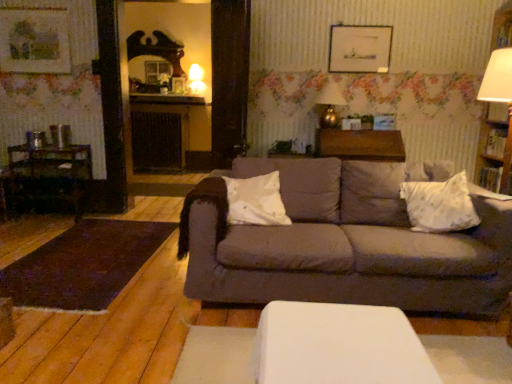
What is the approximate width of wooden table at center?

It is 20.32 inches.

Describe the element at coordinates (359, 48) in the screenshot. I see `wooden picture frame at upper center, which appears as the 2th picture frame when viewed from the left` at that location.

What do you see at coordinates (343, 244) in the screenshot?
I see `matte gray couch at center` at bounding box center [343, 244].

The width and height of the screenshot is (512, 384). Identify the location of wooden dark chair at left. (51, 178).

Would you say matte gray couch at center is inside or outside matte white glass table lamp at upper center, positioned as the first table lamp in left-to-right order?

matte gray couch at center lies outside matte white glass table lamp at upper center, positioned as the first table lamp in left-to-right order.

Between matte gray couch at center and matte white glass table lamp at upper center, which is the first table lamp from back to front, which one is positioned in front?

matte gray couch at center is more forward.

Does matte gray couch at center have a smaller size compared to matte white glass table lamp at upper center, the second table lamp when ordered from front to back?

No, matte gray couch at center is not smaller than matte white glass table lamp at upper center, the second table lamp when ordered from front to back.

From a real-world perspective, is wooden bookshelf at right above or below matte gold table lamp at upper center, acting as the first table lamp starting from the front?

From a real-world perspective, wooden bookshelf at right is physically below matte gold table lamp at upper center, acting as the first table lamp starting from the front.

Is wooden bookshelf at right bigger or smaller than matte gold table lamp at upper center, which appears as the 2th table lamp when viewed from the back?

wooden bookshelf at right is bigger than matte gold table lamp at upper center, which appears as the 2th table lamp when viewed from the back.

Is matte gold table lamp at upper center, marked as the second table lamp in a top-to-bottom arrangement, at the back of wooden bookshelf at right?

No, wooden bookshelf at right is not facing the opposite direction of matte gold table lamp at upper center, marked as the second table lamp in a top-to-bottom arrangement.

Is wooden bookshelf at right shorter than matte gold table lamp at upper center, the 2th table lamp when ordered from left to right?

No, wooden bookshelf at right is not shorter than matte gold table lamp at upper center, the 2th table lamp when ordered from left to right.

Does point (35, 69) appear closer or farther from the camera than point (196, 79)?

Point (35, 69) is positioned closer to the camera compared to point (196, 79).

Considering the sizes of wooden picture frame at upper left, the 2th picture frame positioned from the right, and matte white glass table lamp at upper center, which ranks as the 2th table lamp in right-to-left order, in the image, is wooden picture frame at upper left, the 2th picture frame positioned from the right, bigger or smaller than matte white glass table lamp at upper center, which ranks as the 2th table lamp in right-to-left order,?

wooden picture frame at upper left, the 2th picture frame positioned from the right, is smaller than matte white glass table lamp at upper center, which ranks as the 2th table lamp in right-to-left order.

Is wooden picture frame at upper left, the first picture frame in the left-to-right sequence, completely or partially outside of matte white glass table lamp at upper center, which is the first table lamp from back to front?

That's correct, wooden picture frame at upper left, the first picture frame in the left-to-right sequence, is outside of matte white glass table lamp at upper center, which is the first table lamp from back to front.

I want to click on bookshelf on the right of wooden picture frame at upper center, which appears as the first picture frame when viewed from the right, so click(x=495, y=147).

Considering the sizes of objects wooden bookshelf at right and wooden picture frame at upper center, which appears as the 2th picture frame when viewed from the left, in the image provided, who is shorter, wooden bookshelf at right or wooden picture frame at upper center, which appears as the 2th picture frame when viewed from the left,?

Standing shorter between the two is wooden picture frame at upper center, which appears as the 2th picture frame when viewed from the left.

Which is correct: wooden bookshelf at right is inside wooden picture frame at upper center, which appears as the 2th picture frame when viewed from the left, or outside of it?

wooden bookshelf at right is spatially situated outside wooden picture frame at upper center, which appears as the 2th picture frame when viewed from the left.

Does wooden bookshelf at right have a larger size compared to wooden picture frame at upper center, which appears as the first picture frame when viewed from the right?

Indeed, wooden bookshelf at right has a larger size compared to wooden picture frame at upper center, which appears as the first picture frame when viewed from the right.

At what (x,y) coordinates should I click in order to perform the action: click on chair above the matte gray couch at center (from the image's perspective). Please return your answer as a coordinate pair (x, y). Looking at the image, I should click on (51, 178).

Is matte gray couch at center with wooden dark chair at left?

No, matte gray couch at center is not in contact with wooden dark chair at left.

Could you tell me if matte gray couch at center is turned towards wooden dark chair at left?

No.

Which is more distant, (40, 12) or (362, 158)?

The point (40, 12) is farther.

From the image's perspective, is wooden picture frame at upper left, the 2th picture frame positioned from the right, above wooden table at center?

Yes, from the image's perspective, wooden picture frame at upper left, the 2th picture frame positioned from the right, is on top of wooden table at center.

From the image's perspective, which picture frame is the 2nd one above the wooden table at center? Please provide its 2D coordinates.

[(34, 40)]

Can you confirm if wooden picture frame at upper left, the 2th picture frame positioned from the right, is thinner than wooden table at center?

Yes, wooden picture frame at upper left, the 2th picture frame positioned from the right, is thinner than wooden table at center.

Locate an element on the screen. The image size is (512, 384). throw pillow above the matte gray couch at center (from a real-world perspective) is located at coordinates (440, 205).

Does matte gray couch at center have a larger size compared to white textured pillow at right?

Correct, matte gray couch at center is larger in size than white textured pillow at right.

From a real-world perspective, is matte gray couch at center physically located above or below white textured pillow at right?

matte gray couch at center is situated lower than white textured pillow at right in the real world.

Looking at their sizes, would you say matte gray couch at center is wider or thinner than white textured pillow at right?

Clearly, matte gray couch at center has more width compared to white textured pillow at right.

From the image's perspective, which table lamp is the 2nd one above the matte gray couch at center? Please provide its 2D coordinates.

[(196, 79)]

The height and width of the screenshot is (384, 512). In order to click on the 1st table lamp behind when counting from the wooden bookshelf at right in this screenshot , I will do `click(329, 104)`.

From the image, which object appears to be farther from wooden picture frame at upper left, the first picture frame in the left-to-right sequence, matte white glass table lamp at upper center, which is the first table lamp from back to front, or matte gold table lamp at upper center, the first table lamp from the bottom?

matte gold table lamp at upper center, the first table lamp from the bottom, is further to wooden picture frame at upper left, the first picture frame in the left-to-right sequence.

Estimate the real-world distances between objects in this image. Which object is further from matte white glass table lamp at upper center, which is the 1th table lamp from top to bottom, matte gray couch at center or white soft pillow at center?

matte gray couch at center lies further to matte white glass table lamp at upper center, which is the 1th table lamp from top to bottom, than the other object.

Estimate the real-world distances between objects in this image. Which object is further from white textured pillow at right, wooden picture frame at upper center, which appears as the first picture frame when viewed from the right, or wooden picture frame at upper left, the first picture frame in the left-to-right sequence?

wooden picture frame at upper left, the first picture frame in the left-to-right sequence.

Which object lies nearer to the anchor point wooden table at center, matte white glass table lamp at upper center, which appears as the 2th table lamp when ordered from the bottom, or white textured pillow at right?

white textured pillow at right is positioned closer to the anchor wooden table at center.

When comparing their distances from wooden picture frame at upper center, which appears as the 2th picture frame when viewed from the left, does white textured pillow at right or matte white glass table lamp at upper center, which appears as the 2th table lamp when ordered from the bottom, seem closer?

matte white glass table lamp at upper center, which appears as the 2th table lamp when ordered from the bottom, is positioned closer to the anchor wooden picture frame at upper center, which appears as the 2th picture frame when viewed from the left.

Based on their spatial positions, is wooden picture frame at upper left, the 2th picture frame positioned from the right, or wooden bookshelf at right further from wooden table at center?

Based on the image, wooden picture frame at upper left, the 2th picture frame positioned from the right, appears to be further to wooden table at center.

When comparing their distances from wooden table at center, does matte gold table lamp at upper center, marked as the second table lamp in a top-to-bottom arrangement, or white textured pillow at right seem further?

white textured pillow at right is further to wooden table at center.

Estimate the real-world distances between objects in this image. Which object is closer to matte white glass table lamp at upper center, which ranks as the 2th table lamp in right-to-left order, white textured pillow at right or white soft pillow at center?

white soft pillow at center is closer to matte white glass table lamp at upper center, which ranks as the 2th table lamp in right-to-left order.

You are a GUI agent. You are given a task and a screenshot of the screen. Output one action in this format:
    pyautogui.click(x=<x>, y=<y>)
    Task: Click on the table positioned between white soft pillow at center and wooden picture frame at upper center, which appears as the 2th picture frame when viewed from the left, from near to far
    
    Given the screenshot: What is the action you would take?
    pyautogui.click(x=360, y=144)

You are a GUI agent. You are given a task and a screenshot of the screen. Output one action in this format:
    pyautogui.click(x=<x>, y=<y>)
    Task: Click on the throw pillow between matte gray couch at center and wooden table at center from front to back
    
    Given the screenshot: What is the action you would take?
    pyautogui.click(x=440, y=205)

Where is `studio couch between wooden picture frame at upper left, the first picture frame in the left-to-right sequence, and matte gold table lamp at upper center, the first table lamp from the bottom, from left to right`? This screenshot has height=384, width=512. studio couch between wooden picture frame at upper left, the first picture frame in the left-to-right sequence, and matte gold table lamp at upper center, the first table lamp from the bottom, from left to right is located at coordinates (343, 244).

Identify the location of table between matte gold table lamp at upper center, which appears as the 2th table lamp when viewed from the back, and wooden bookshelf at right. (360, 144).